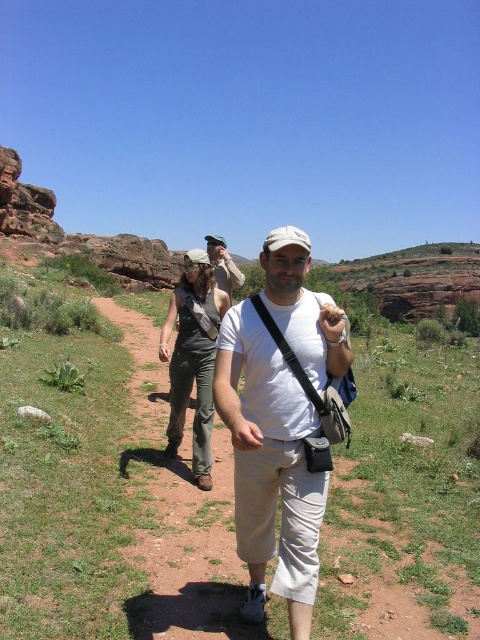
You are a photographer trying to capture the group of hikers. The white cotton shirt at center and the matte khaki pants at center are in your viewfinder. Which clothing item appears shorter in the photo?

The white cotton shirt at center appears shorter than the matte khaki pants at center because it is not as tall as the matte khaki pants at center.

You are standing at the point labeled point (296, 368) and want to walk towards the point labeled point (220, 273). Which direction should you face to move towards it?

Since point (296, 368) is closer to the viewer than point (220, 273), you should face away from the viewer to move towards point (220, 273).